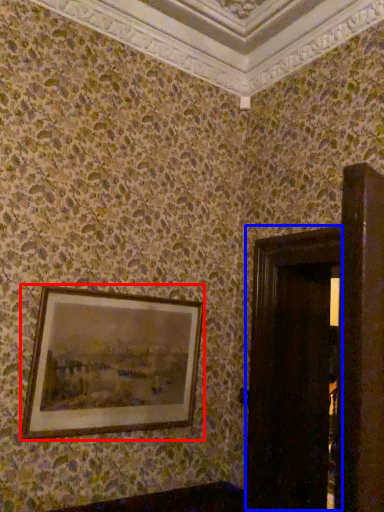
Question: Among these objects, which one is farthest to the camera, picture frame (highlighted by a red box) or door (highlighted by a blue box)?

Choices:
 (A) picture frame
 (B) door

Answer: (A)